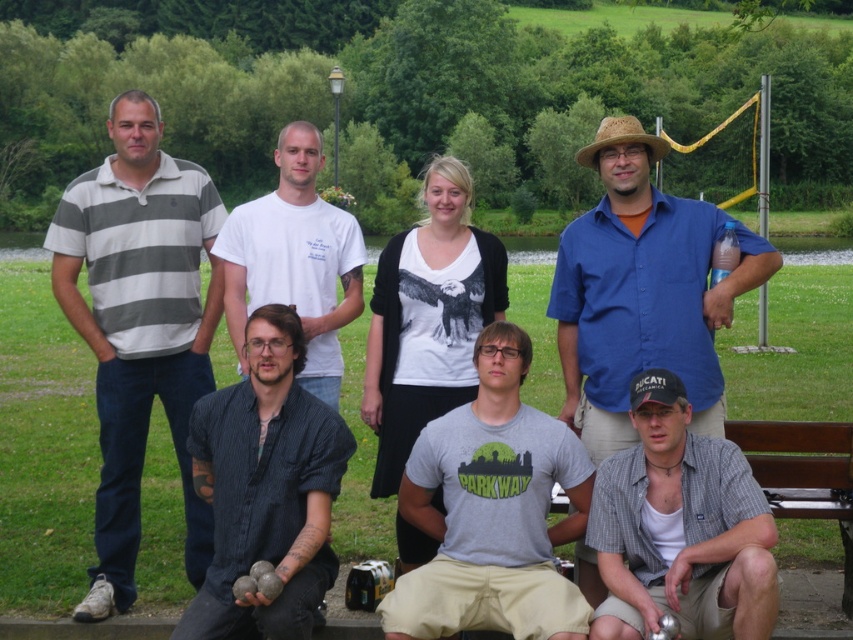
Who is positioned more to the left, gray checkered shirt at lower center or brown wooden bench at lower right?

Positioned to the left is gray checkered shirt at lower center.

Between point (660, 413) and point (792, 486), which one is positioned behind?

The point (792, 486) is behind.

Where is `gray checkered shirt at lower center`? The height and width of the screenshot is (640, 853). gray checkered shirt at lower center is located at coordinates (680, 528).

Is point (583, 506) farther from viewer compared to point (223, 636)?

Yes, point (583, 506) is behind point (223, 636).

This screenshot has width=853, height=640. Describe the element at coordinates (492, 512) in the screenshot. I see `gray cotton t-shirt at center` at that location.

Who is more forward, [426,620] or [256,628]?

Point [426,620]

What are the coordinates of `gray cotton t-shirt at center` in the screenshot? It's located at 492,512.

From the picture: Is blue cotton shirt at upper right thinner than gray checkered shirt at lower center?

No, blue cotton shirt at upper right is not thinner than gray checkered shirt at lower center.

Is blue cotton shirt at upper right smaller than gray checkered shirt at lower center?

No.

Who is more forward, (735, 289) or (642, 600)?

Point (642, 600)

The width and height of the screenshot is (853, 640). Identify the location of blue cotton shirt at upper right. (643, 300).